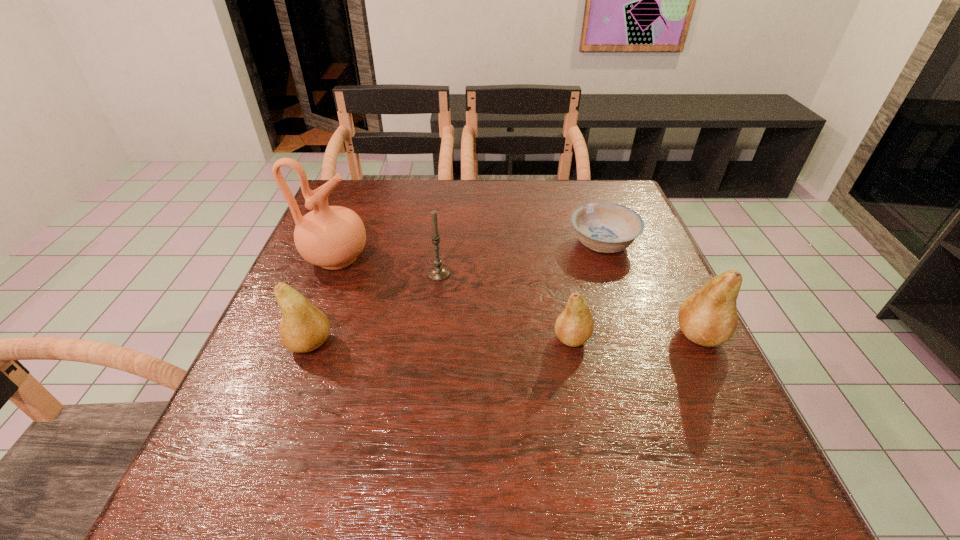
To achieve uniform spacing by inserting another pear among them, please point to a free space for this new pear. Please provide its 2D coordinates. Your answer should be formatted as a tuple, i.e. [(x, y)], where the tuple contains the x and y coordinates of a point satisfying the conditions above.

[(442, 341)]